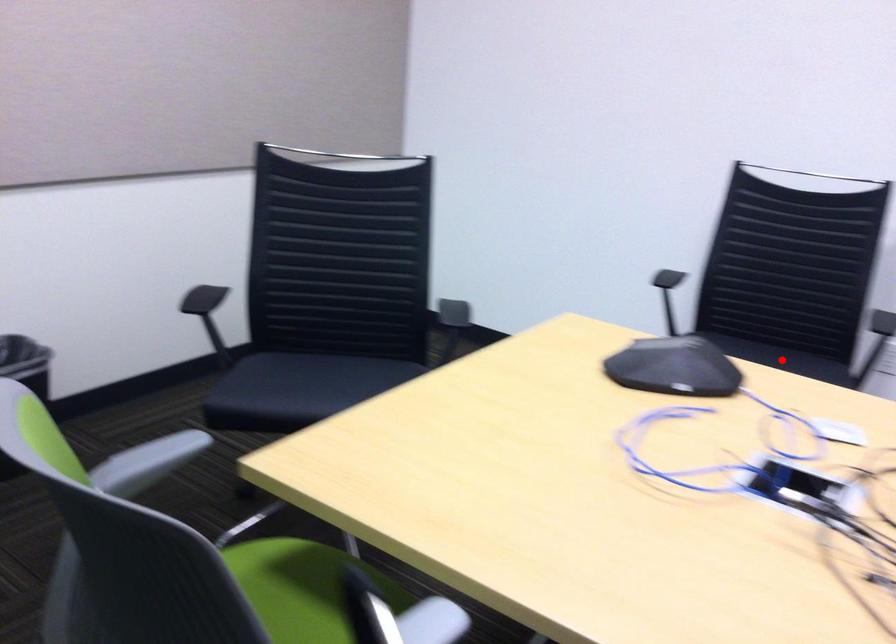
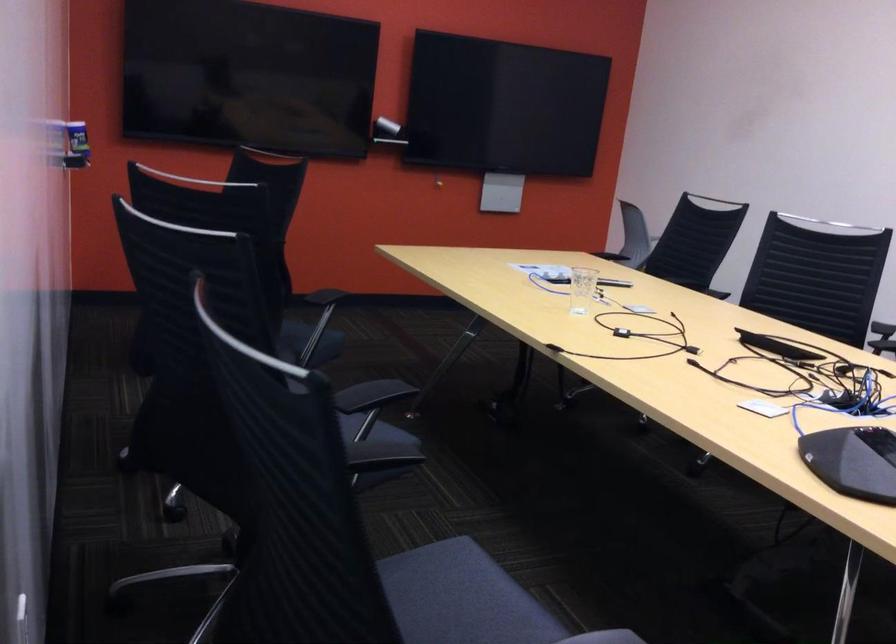
Find the pixel in the second image that matches the highlighted location in the first image.

(461, 598)